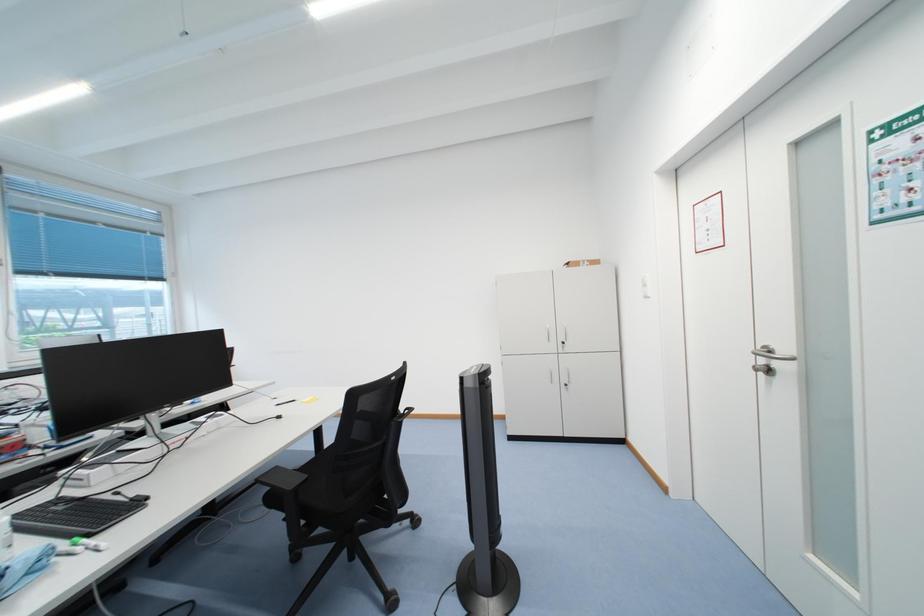
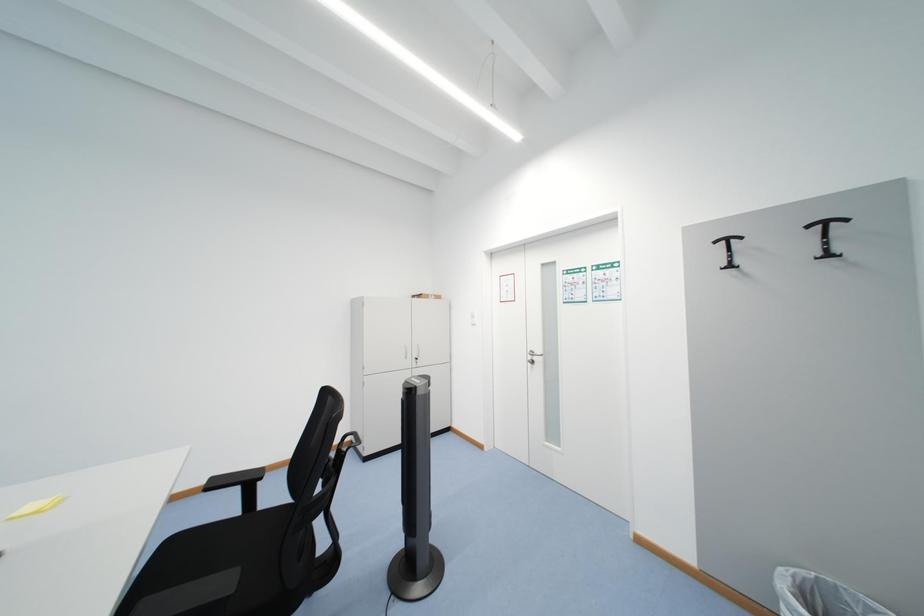
Question: The first image is from the beginning of the video and the second image is from the end. How did the camera likely rotate when shooting the video?

Choices:
 (A) Left
 (B) Right
 (C) Up
 (D) Down

Answer: (B)